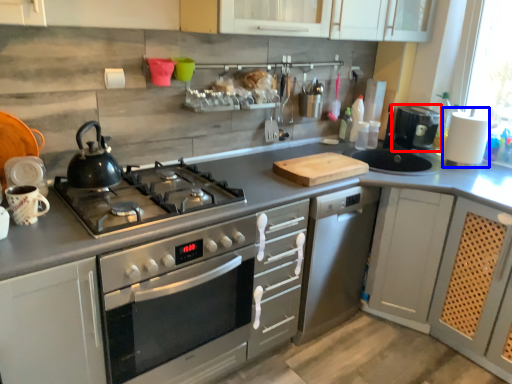
Question: Which of the following is the farthest to the observer, coffee machine (highlighted by a red box) or appliance (highlighted by a blue box)?

Choices:
 (A) coffee machine
 (B) appliance

Answer: (A)